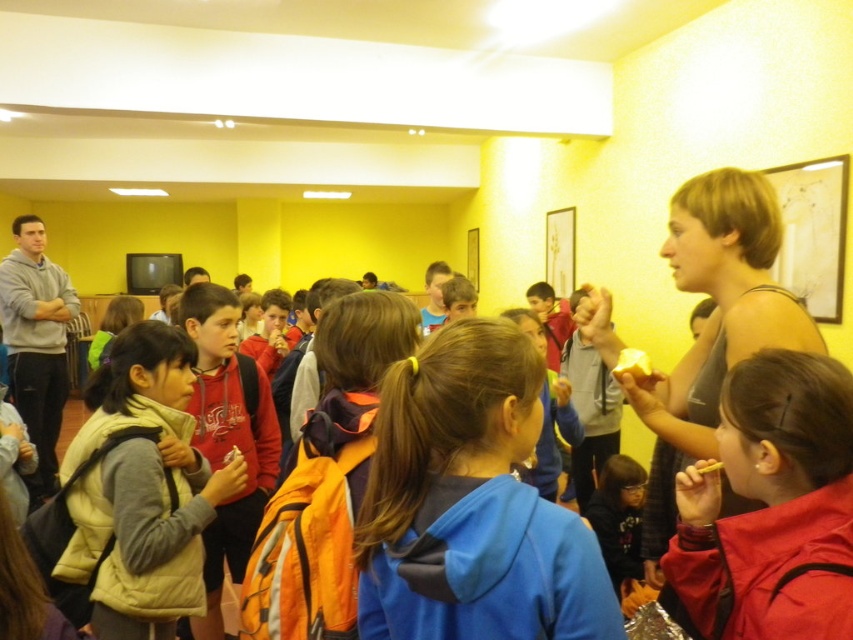
Question: Among these objects, which one is nearest to the camera?

Choices:
 (A) matte red jacket at lower right
 (B) light yellow puffer vest at center
 (C) blue fleece jacket at center

Answer: (C)

Question: Does matte red jacket at lower right appear under light yellow puffer vest at center?

Choices:
 (A) no
 (B) yes

Answer: (A)

Question: Which point is farther from the camera taking this photo?

Choices:
 (A) (434, 604)
 (B) (810, 554)
 (C) (154, 465)

Answer: (C)

Question: Is matte red jacket at lower right thinner than light yellow puffer vest at center?

Choices:
 (A) yes
 (B) no

Answer: (A)

Question: Which point appears closest to the camera in this image?

Choices:
 (A) (827, 572)
 (B) (534, 396)
 (C) (109, 611)

Answer: (A)

Question: Is the position of blue fleece jacket at center more distant than that of light yellow puffer vest at center?

Choices:
 (A) yes
 (B) no

Answer: (B)